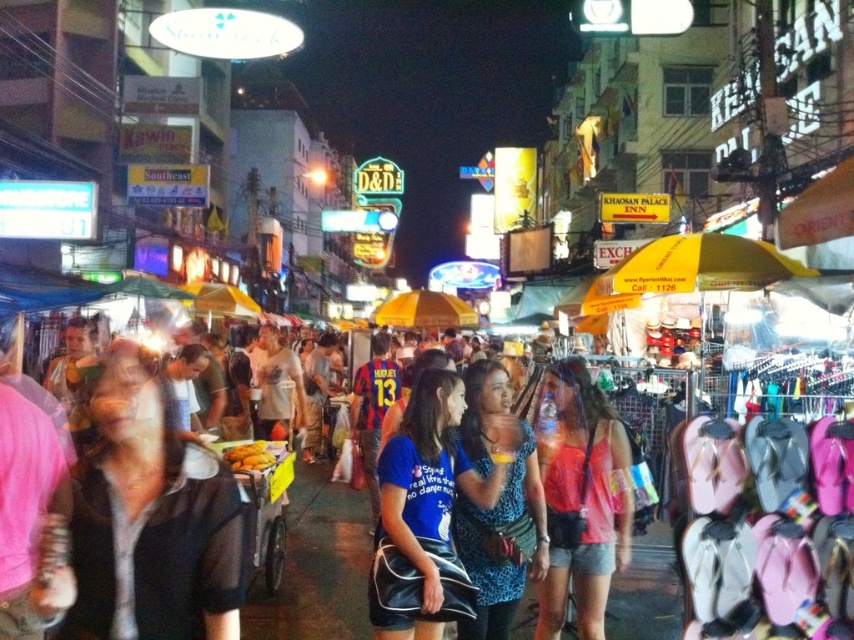
In the night market scene, you notice two people dressed in a matte pink tank top at center and a blue printed dress at center. Which clothing item is positioned lower on the person?

The matte pink tank top at center is located below the blue printed dress at center, so the matte pink tank top at center is positioned lower on the person.

You are standing in the night market and want to take a photo of the matte pink tank top at center and the yellow fabric umbrella at center. Which object should you focus on first to ensure both are in the frame without moving the camera?

You should focus on the matte pink tank top at center first because it is closer to the viewer than the yellow fabric umbrella at center, so adjusting the focus to the closer object will help keep both in the frame.

You are a photographer trying to capture a clear shot of both the blue printed dress at center and the yellow fabric umbrella at center in the night market scene. Which object should you focus on first to ensure it appears in the foreground of your photo?

The blue printed dress at center is taller than the yellow fabric umbrella at center, so focusing on the blue printed dress at center first will ensure it appears in the foreground.